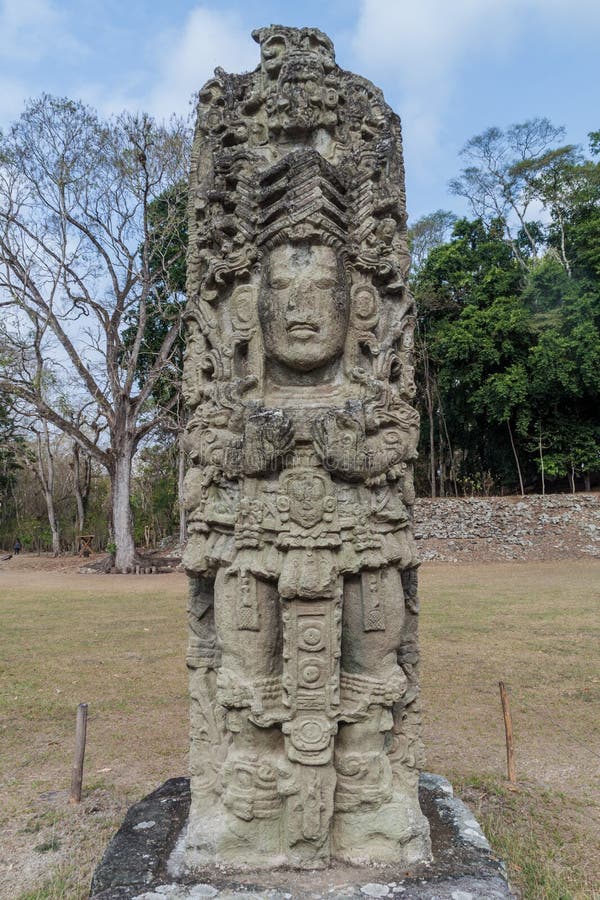
Find the location of a particular element. Image resolution: width=600 pixels, height=900 pixels. statue is located at coordinates (307, 383).